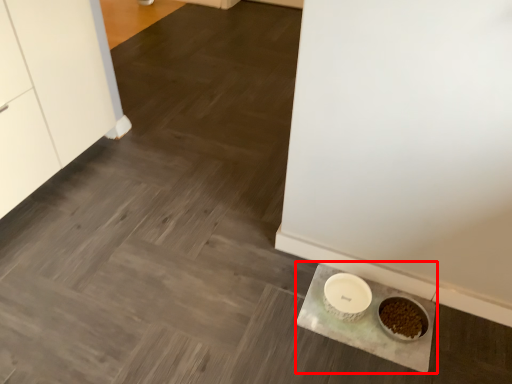
Question: Where is slate (annotated by the red box) located in relation to bowl in the image?

Choices:
 (A) left
 (B) right

Answer: (B)